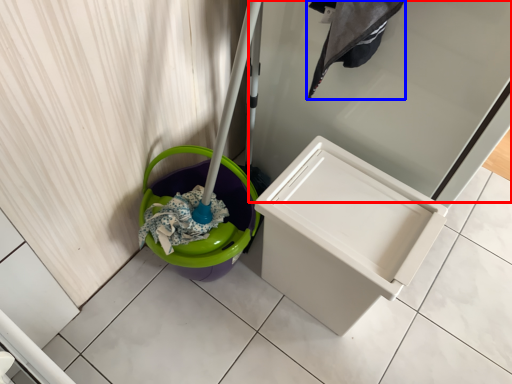
Question: Which object is further to the camera taking this photo, screen door (highlighted by a red box) or laundry (highlighted by a blue box)?

Choices:
 (A) screen door
 (B) laundry

Answer: (B)